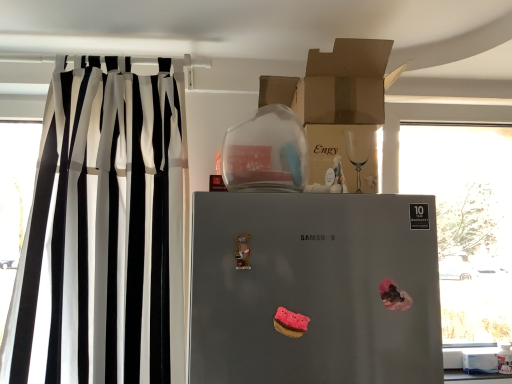
Question: Is black/white striped curtain at left situated inside white cardboard box at lower right or outside?

Choices:
 (A) inside
 (B) outside

Answer: (B)

Question: In the image, is black/white striped curtain at left positioned in front of or behind white cardboard box at lower right?

Choices:
 (A) behind
 (B) front

Answer: (B)

Question: Estimate the real-world distances between objects in this image. Which object is closer to the black/white striped curtain at left?

Choices:
 (A) transparent glass jar at upper center
 (B) cardboard box at upper center, arranged as the second cardboard box when ordered from the bottom
 (C) white cardboard box at lower right
 (D) pink matte donut at center, the first stuff from the left
 (E) transparent glass window at right

Answer: (A)

Question: Which is nearer to the pink matte donut at center, positioned as the first stuff in front-to-back order?

Choices:
 (A) matte brown cardboard box at upper center, arranged as the 1th cardboard box when ordered from the bottom
 (B) cardboard box at upper center, which is the 1th cardboard box in top-to-bottom order
 (C) white cardboard box at lower right
 (D) satin silver refrigerator at center
 (E) transparent glass window at right

Answer: (D)